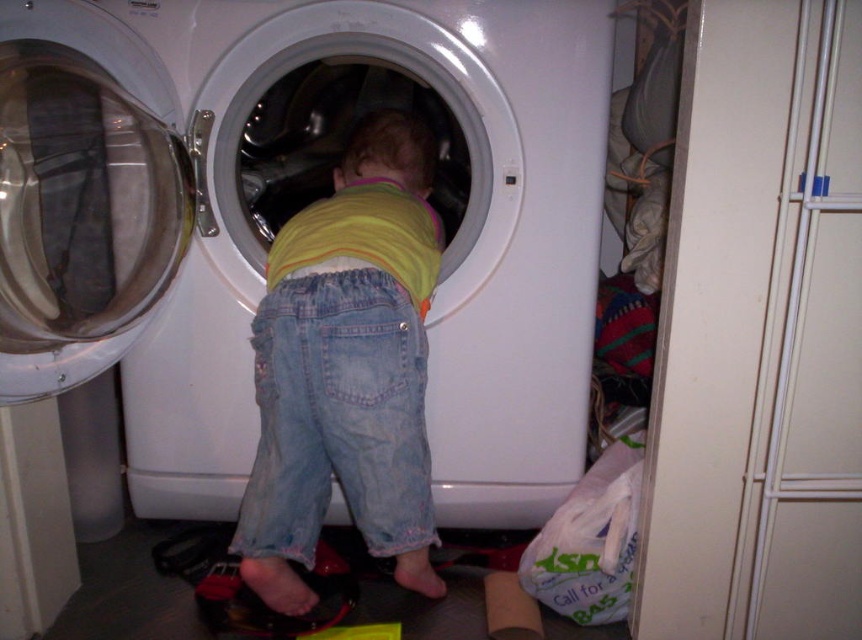
Question: Considering the relative positions of white glossy washing machine at center and denim pants at center in the image provided, where is white glossy washing machine at center located with respect to denim pants at center?

Choices:
 (A) left
 (B) right

Answer: (A)

Question: Is white glossy washing machine at center closer to the viewer compared to denim pants at center?

Choices:
 (A) yes
 (B) no

Answer: (A)

Question: Among these points, which one is nearest to the camera?

Choices:
 (A) (298, 451)
 (B) (245, 228)

Answer: (A)

Question: Which point is closer to the camera taking this photo?

Choices:
 (A) (276, 486)
 (B) (248, 256)

Answer: (A)

Question: Is white glossy washing machine at center bigger than denim pants at center?

Choices:
 (A) no
 (B) yes

Answer: (B)

Question: Which point is closer to the camera?

Choices:
 (A) white glossy washing machine at center
 (B) denim pants at center

Answer: (A)